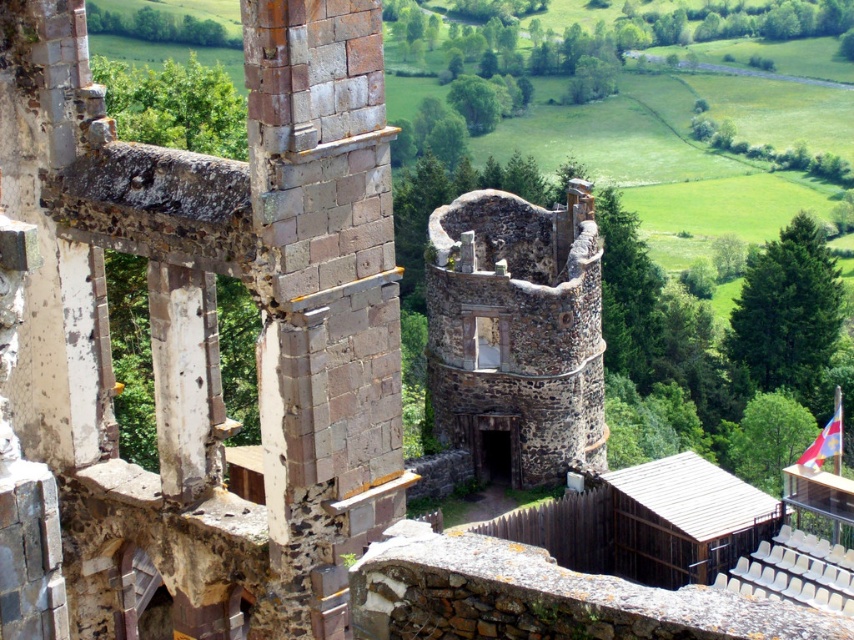
What are the coordinates of the rusty stone tower at center in the image?

The coordinates of the rusty stone tower at center are at point (212,323).